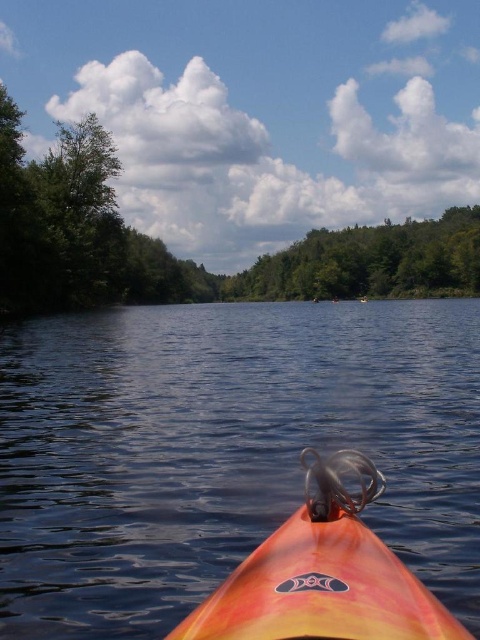
Does orange plastic kayak at lower center appear under green leafy tree at upper center?

Yes, orange plastic kayak at lower center is below green leafy tree at upper center.

Which of these two, orange plastic kayak at lower center or green leafy tree at upper center, stands shorter?

orange plastic kayak at lower center

What do you see at coordinates (224, 451) in the screenshot? I see `orange plastic kayak at lower center` at bounding box center [224, 451].

I want to click on orange plastic kayak at lower center, so click(224, 451).

Who is lower down, orange plastic kayak at lower center or orange matte kayak at lower center?

orange matte kayak at lower center is lower down.

Can you confirm if orange plastic kayak at lower center is shorter than orange matte kayak at lower center?

Incorrect, orange plastic kayak at lower center's height does not fall short of orange matte kayak at lower center's.

Is point (165, 310) farther from camera compared to point (312, 492)?

That is True.

What are the coordinates of `orange plastic kayak at lower center` in the screenshot? It's located at (224, 451).

Which is below, orange plastic kayak at lower center or green leafy trees at upper center?

orange plastic kayak at lower center

Who is shorter, orange plastic kayak at lower center or green leafy trees at upper center?

orange plastic kayak at lower center is shorter.

Is point (383, 467) farther from camera compared to point (323, 285)?

No, it is not.

You are a GUI agent. You are given a task and a screenshot of the screen. Output one action in this format:
    pyautogui.click(x=<x>, y=<y>)
    Task: Click on the orange plastic kayak at lower center
    The height and width of the screenshot is (640, 480).
    Given the screenshot: What is the action you would take?
    pyautogui.click(x=224, y=451)